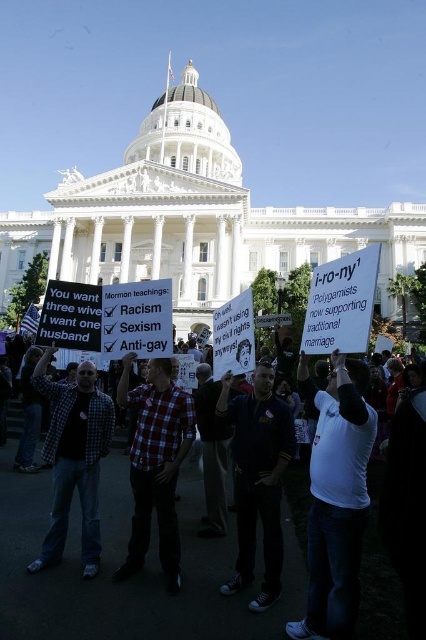
Between point (273, 500) and point (167, 358), which one is positioned behind?

The point (167, 358) is behind.

Can you confirm if dark blue shirt at center is shorter than plaid shirt at center?

Correct, dark blue shirt at center is not as tall as plaid shirt at center.

Image resolution: width=426 pixels, height=640 pixels. In order to click on dark blue shirt at center in this screenshot , I will do `click(258, 477)`.

Between white t-shirt at center and plaid shirt at center, which one has more height?

white t-shirt at center

Does white t-shirt at center have a greater height compared to plaid shirt at center?

Indeed, white t-shirt at center has a greater height compared to plaid shirt at center.

What do you see at coordinates (336, 499) in the screenshot? The width and height of the screenshot is (426, 640). I see `white t-shirt at center` at bounding box center [336, 499].

Locate an element on the screen. The height and width of the screenshot is (640, 426). white t-shirt at center is located at coordinates (336, 499).

Can you confirm if white paper signs at center is positioned above plaid shirt at center?

No.

Is white paper signs at center closer to camera compared to plaid shirt at center?

Yes, white paper signs at center is closer to the viewer.

Where is `white paper signs at center`? white paper signs at center is located at coordinates (137, 576).